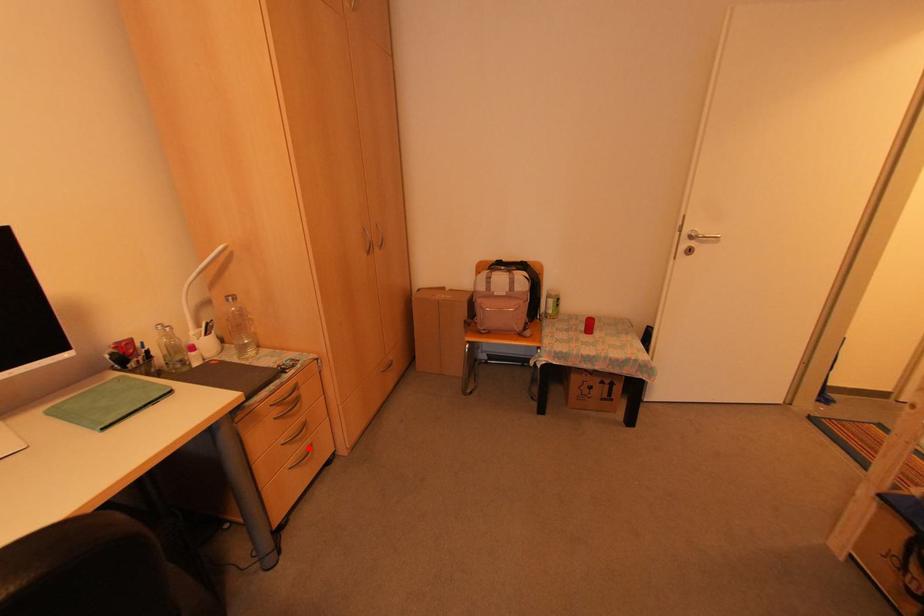
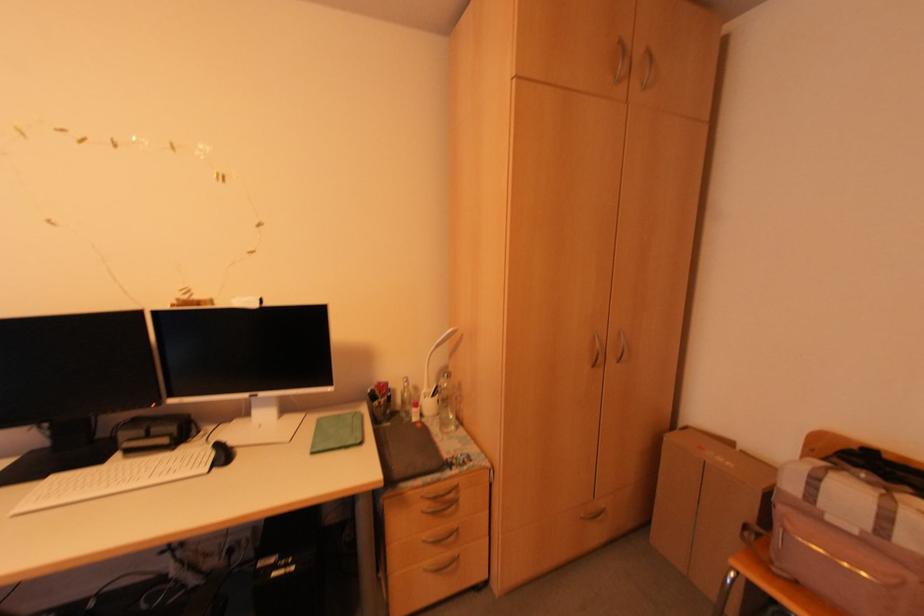
Question: I am providing you with two images of the same scene from different viewpoints. Given a red point in image1, look at the same physical point in image2. Is it:

Choices:
 (A) Closer to the viewpoint
 (B) Farther from the viewpoint

Answer: (B)